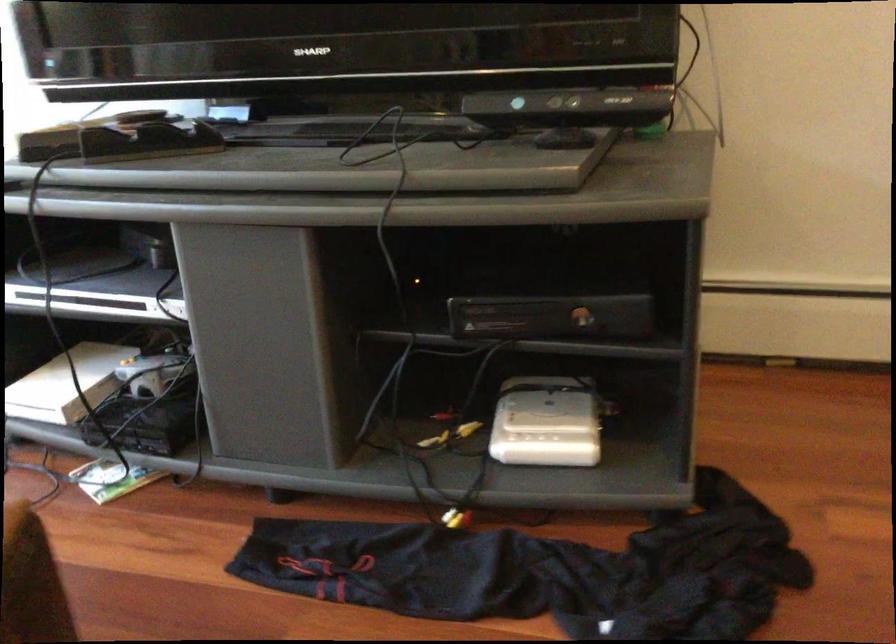
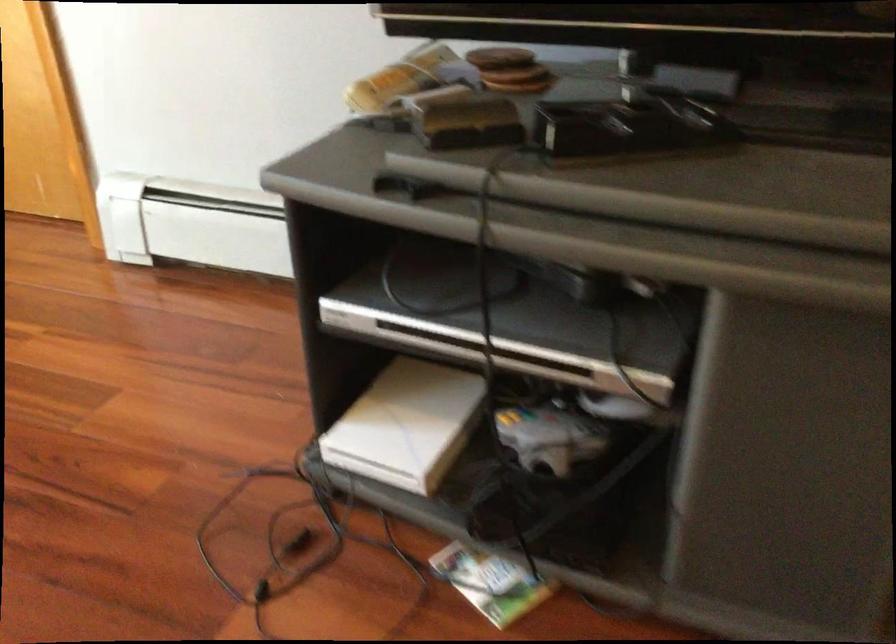
Which direction would the cameraman need to move to produce the second image?

The movement direction of the cameraman is left, forward.